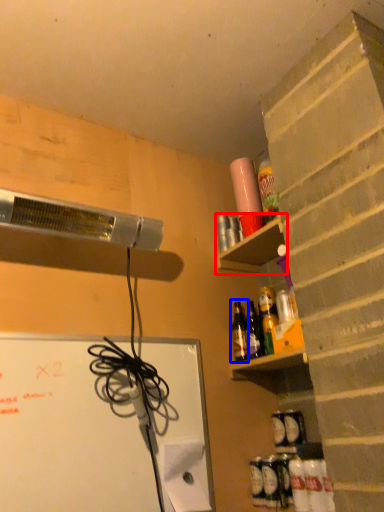
Question: Among these objects, which one is nearest to the camera, shelf (highlighted by a red box) or bottle (highlighted by a blue box)?

Choices:
 (A) shelf
 (B) bottle

Answer: (A)